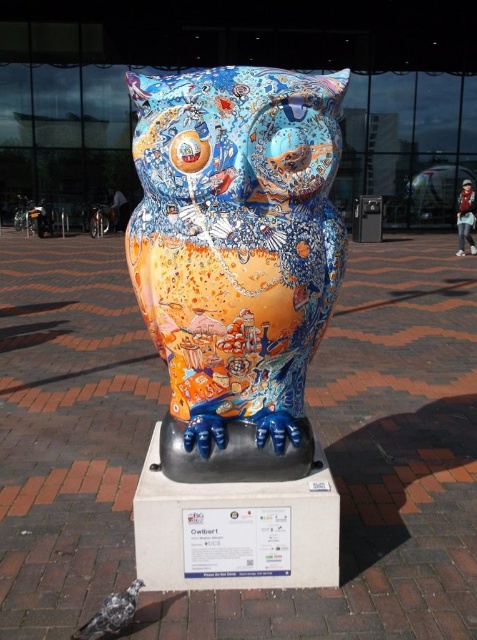
You are an artist trying to sketch the scene from memory. You remember seeing a painted ceramic owl at center and a speckled gray pigeon at lower left. Based on the spatial arrangement, which object is located more to the right?

The painted ceramic owl at center is positioned on the right side of the speckled gray pigeon at lower left, so the painted ceramic owl at center is more to the right.

Consider the image. You are a delivery person trying to place a small box between the painted ceramic owl at center and the speckled gray pigeon at lower left. The box is 10 cm wide. Can you fit it there?

The painted ceramic owl at center might be wider than the speckled gray pigeon at lower left, so there might not be enough space to fit a 10 cm wide box between them.

You are standing in front of the vibrant owl sculpture described in the scene. The owl is mounted on a black pedestal with a white base. There is a point marked at coordinates (236, 259). What object is located at this point?

The point at coordinates (236, 259) marks the painted ceramic owl at center.